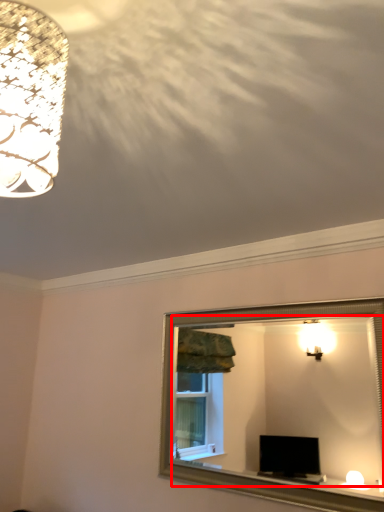
Question: From the image's perspective, what is the correct spatial relationship of mirror (annotated by the red box) in relation to lamp?

Choices:
 (A) above
 (B) below

Answer: (B)